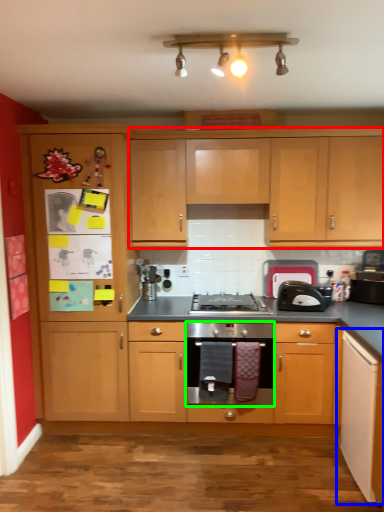
Question: Estimate the real-world distances between objects in this image. Which object is closer to cabinetry (highlighted by a red box), cabinetry (highlighted by a blue box) or oven (highlighted by a green box)?

Choices:
 (A) cabinetry
 (B) oven

Answer: (B)